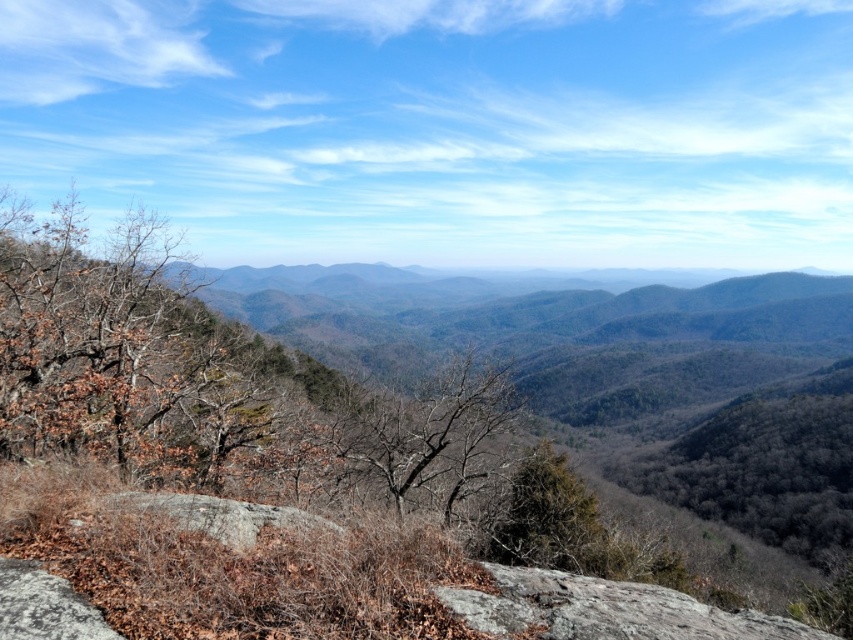
Question: Does dark green leafy tree at center-right have a lesser width compared to green leafy tree at center?

Choices:
 (A) yes
 (B) no

Answer: (B)

Question: Which object is the farthest from the gray rough rock at center?

Choices:
 (A) brown/dry bark tree at center
 (B) dark green leafy tree at center-right
 (C) brown leafy tree at left
 (D) green leafy tree at center

Answer: (B)

Question: Which point appears farthest from the camera in this image?

Choices:
 (A) (97, 394)
 (B) (442, 422)
 (C) (579, 506)
 (D) (811, 548)

Answer: (D)

Question: Can you confirm if brown/dry bark tree at center is positioned above gray rough rock at center?

Choices:
 (A) no
 (B) yes

Answer: (A)

Question: Which point is farther to the camera?

Choices:
 (A) (724, 516)
 (B) (263, 515)

Answer: (A)

Question: Does brown leafy tree at left appear over dark green leafy tree at center-right?

Choices:
 (A) yes
 (B) no

Answer: (A)